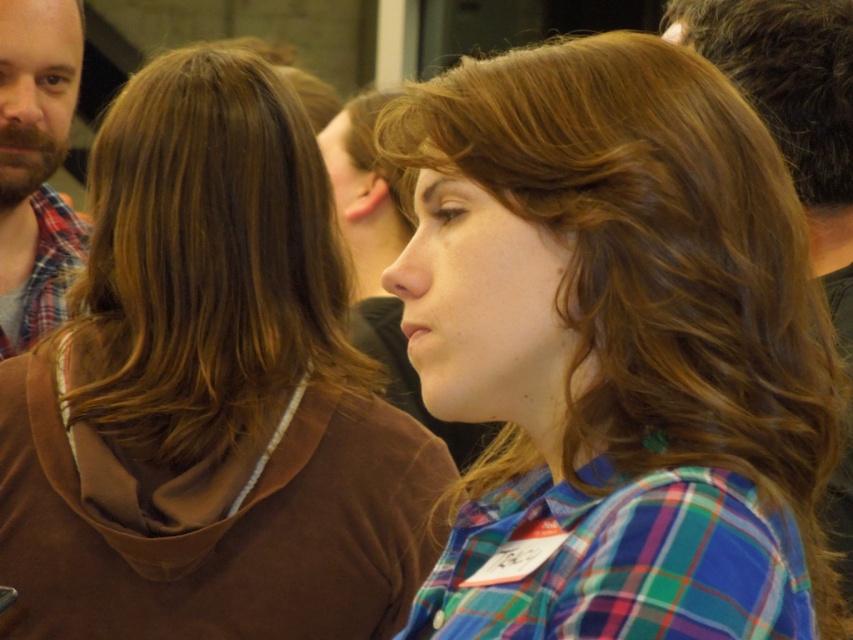
You are standing in the social gathering shown in the image. There is a point at coordinates (381, 260). What object is located at that point?

The point at coordinates (381, 260) corresponds to the matte black shirt at center.

You are organizing a photo shoot and need to place a matte black shirt at center in the scene. Where exactly should you position it?

You should position the matte black shirt at center at point (381,260).